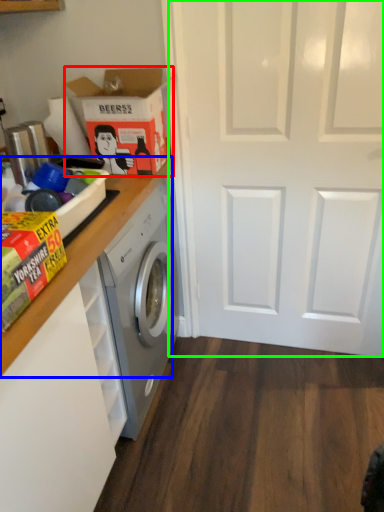
Question: Estimate the real-world distances between objects in this image. Which object is closer to cardboard box (highlighted by a red box), counter top (highlighted by a blue box) or screen door (highlighted by a green box)?

Choices:
 (A) counter top
 (B) screen door

Answer: (A)